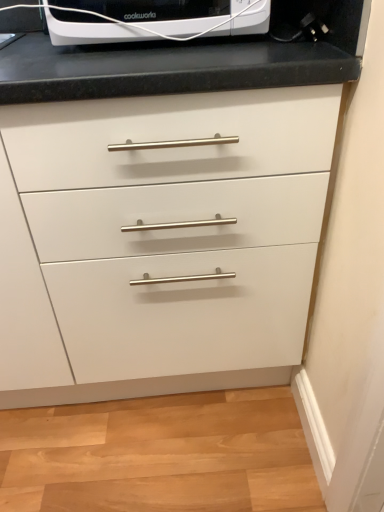
Question: Is white glossy appliance at upper center to the left of white matte cabinet at center from the viewer's perspective?

Choices:
 (A) no
 (B) yes

Answer: (A)

Question: Considering the relative positions of white glossy appliance at upper center and white matte cabinet at center in the image provided, is white glossy appliance at upper center in front of white matte cabinet at center?

Choices:
 (A) yes
 (B) no

Answer: (B)

Question: From a real-world perspective, is white glossy appliance at upper center physically above white matte cabinet at center?

Choices:
 (A) no
 (B) yes

Answer: (B)

Question: Does white glossy appliance at upper center touch white matte cabinet at center?

Choices:
 (A) no
 (B) yes

Answer: (A)

Question: Can you confirm if white glossy appliance at upper center is taller than white matte cabinet at center?

Choices:
 (A) no
 (B) yes

Answer: (A)

Question: Is white matte cabinet at center at the back of white glossy appliance at upper center?

Choices:
 (A) yes
 (B) no

Answer: (B)

Question: Is white matte cabinet at center completely or partially outside of white glossy appliance at upper center?

Choices:
 (A) no
 (B) yes

Answer: (B)

Question: Would you consider white matte cabinet at center to be distant from white glossy appliance at upper center?

Choices:
 (A) no
 (B) yes

Answer: (A)

Question: Is white matte cabinet at center touching white glossy appliance at upper center?

Choices:
 (A) yes
 (B) no

Answer: (B)

Question: Is white matte cabinet at center shorter than white glossy appliance at upper center?

Choices:
 (A) no
 (B) yes

Answer: (A)

Question: From a real-world perspective, is white matte cabinet at center on white glossy appliance at upper center?

Choices:
 (A) no
 (B) yes

Answer: (A)

Question: Does white matte cabinet at center have a lesser width compared to white glossy appliance at upper center?

Choices:
 (A) no
 (B) yes

Answer: (A)

Question: Visually, is white glossy appliance at upper center positioned to the left or to the right of white matte cabinet at center?

Choices:
 (A) right
 (B) left

Answer: (A)